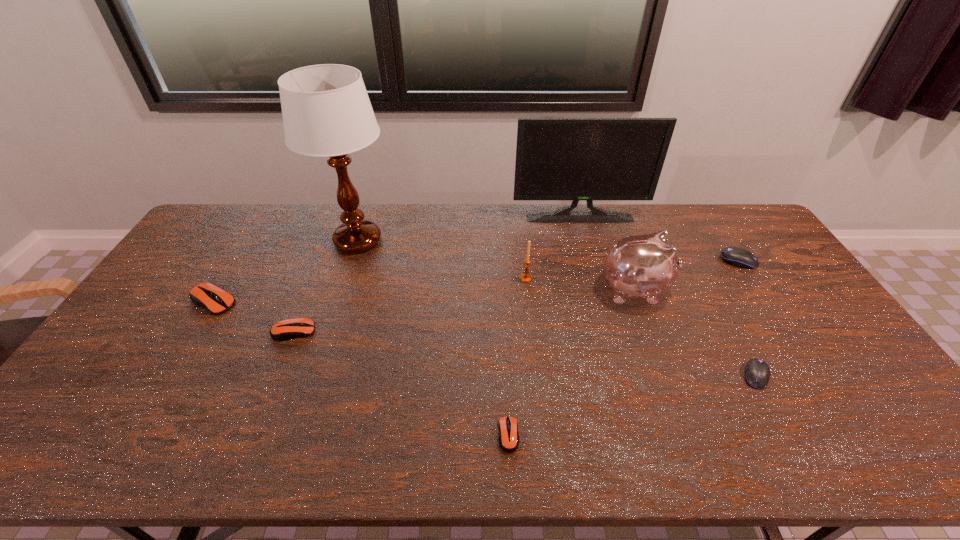
Find the location of a particular element. This screenshot has height=540, width=960. the second orange computer mouse from left to right is located at coordinates pyautogui.click(x=288, y=329).

You are a GUI agent. You are given a task and a screenshot of the screen. Output one action in this format:
    pyautogui.click(x=<x>, y=<y>)
    Task: Click on the nearer black computer mouse
    The width and height of the screenshot is (960, 540).
    Given the screenshot: What is the action you would take?
    pyautogui.click(x=757, y=373)

Find the location of a particular element. The width and height of the screenshot is (960, 540). the second nearest object is located at coordinates (757, 373).

At what (x,y) coordinates should I click in order to perform the action: click on the smallest orange computer mouse. Please return your answer as a coordinate pair (x, y). Looking at the image, I should click on (508, 426).

At what (x,y) coordinates should I click in order to perform the action: click on the nearest computer mouse. Please return your answer as a coordinate pair (x, y). The height and width of the screenshot is (540, 960). Looking at the image, I should click on click(508, 426).

The image size is (960, 540). In order to click on vacant region located 0.350m on the left of the table lamp in this screenshot , I will do `click(221, 241)`.

Find the location of a particular element. The width and height of the screenshot is (960, 540). free space located 0.050m on the front-facing side of the monitor is located at coordinates (583, 231).

I want to click on vacant region located 0.080m on the front facing side of the piggy bank, so click(x=696, y=289).

Find the location of a particular element. free space located on the front of the candle_holder is located at coordinates (530, 318).

Where is `vacant space located on the front of the leftmost orange computer mouse`? The image size is (960, 540). vacant space located on the front of the leftmost orange computer mouse is located at coordinates tap(159, 390).